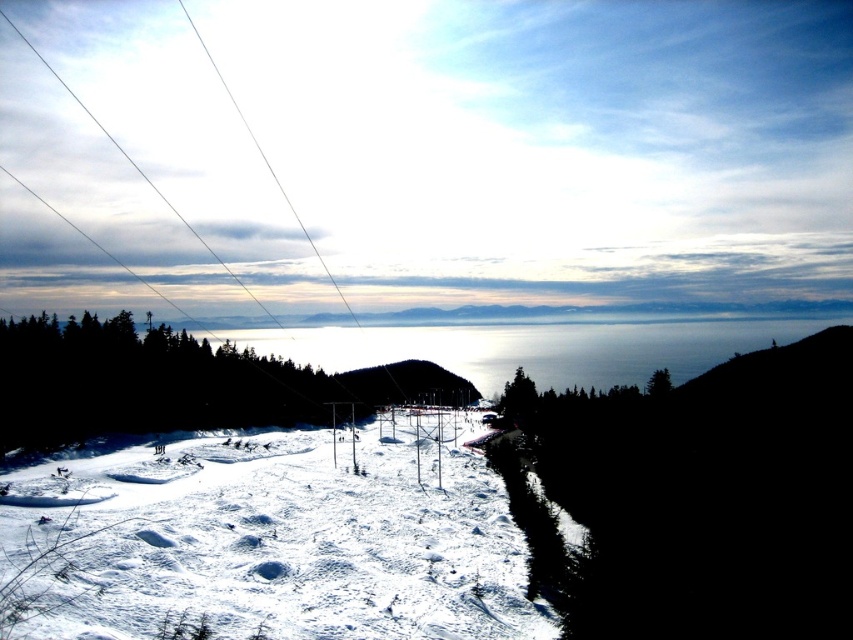
Is white powdery snow at center smaller than black matte hill at lower right?

Yes, white powdery snow at center is smaller than black matte hill at lower right.

From the picture: Between white powdery snow at center and black matte hill at lower right, which one is positioned lower?

white powdery snow at center is lower down.

Between point (454, 502) and point (840, 396), which one is positioned in front?

Point (454, 502)

You are a GUI agent. You are given a task and a screenshot of the screen. Output one action in this format:
    pyautogui.click(x=<x>, y=<y>)
    Task: Click on the white powdery snow at center
    The image size is (853, 640).
    Given the screenshot: What is the action you would take?
    pyautogui.click(x=267, y=541)